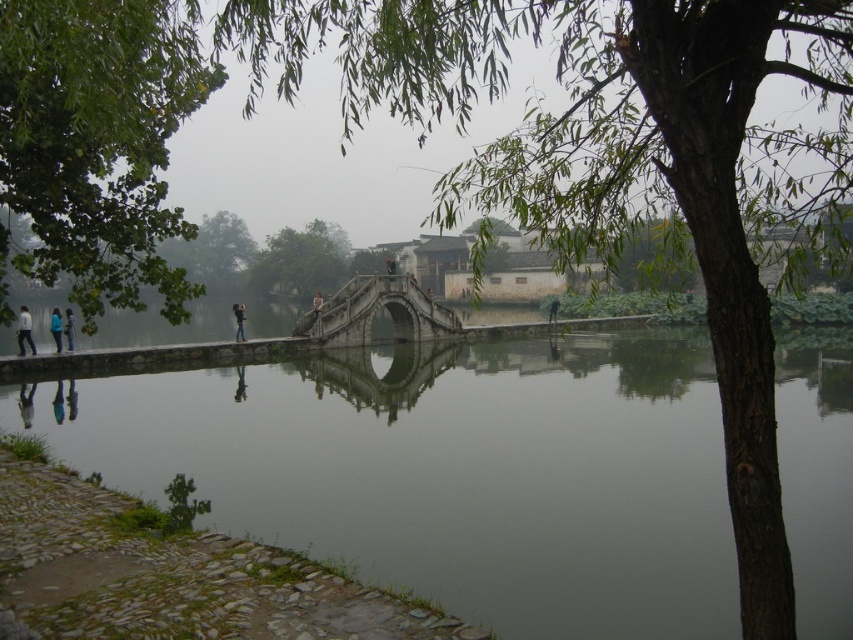
The height and width of the screenshot is (640, 853). In order to click on green leafy tree at upper right in this screenshot , I will do pos(614,161).

The height and width of the screenshot is (640, 853). Describe the element at coordinates (614, 161) in the screenshot. I see `green leafy tree at upper right` at that location.

Which is behind, point (430, 125) or point (27, 320)?

The point (430, 125) is more distant.

Where is `green leafy tree at upper right`? The width and height of the screenshot is (853, 640). green leafy tree at upper right is located at coordinates (614, 161).

Between dark blue jeans at center and blue fabric person at lower left, which one is positioned lower?

blue fabric person at lower left is below.

Where is `dark blue jeans at center`? dark blue jeans at center is located at coordinates pos(238,321).

Locate an element on the screen. Image resolution: width=853 pixels, height=640 pixels. dark blue jeans at center is located at coordinates (238, 321).

Does green leafy tree at center appear on the right side of blue denim jeans at left?

Correct, you'll find green leafy tree at center to the right of blue denim jeans at left.

Is green leafy tree at center smaller than blue denim jeans at left?

No.

This screenshot has height=640, width=853. What do you see at coordinates (300, 260) in the screenshot?
I see `green leafy tree at center` at bounding box center [300, 260].

Find the location of `green leafy tree at center`. green leafy tree at center is located at coordinates (300, 260).